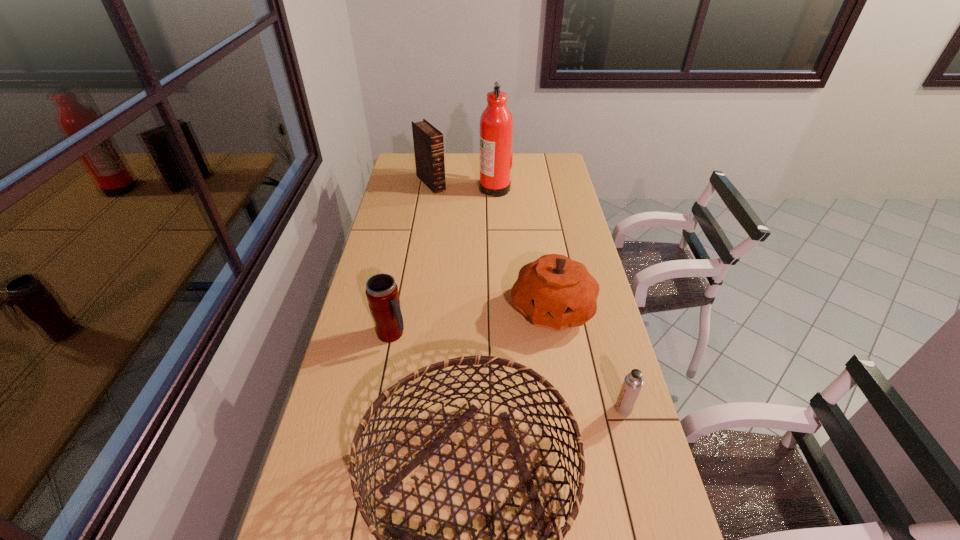
Identify the location of vacant space at the far edge of the desktop. The image size is (960, 540). 476,164.

Where is `blank space at the left edge`? This screenshot has height=540, width=960. blank space at the left edge is located at coordinates (364, 375).

The height and width of the screenshot is (540, 960). In the image, there is a desktop. Find the location of `free space at the right edge`. free space at the right edge is located at coordinates (561, 248).

At what (x,y) coordinates should I click in order to perform the action: click on free space at the far left corner of the desktop. Please return your answer as a coordinate pair (x, y). Looking at the image, I should click on (414, 172).

Find the location of a particular element. Image resolution: width=960 pixels, height=540 pixels. free space between the pumpkin and the shorter thermos bottle is located at coordinates (588, 359).

Find the location of a particular element. vacant area that lies between the pumpkin and the left thermos bottle is located at coordinates (472, 321).

Find the location of a particular element. This screenshot has height=540, width=960. empty location between the fire extinguisher and the pumpkin is located at coordinates (523, 248).

Locate an element on the screen. This screenshot has width=960, height=540. object that is the fourth closest one to the Bible is located at coordinates (407, 538).

Find the location of a particular element. This screenshot has height=540, width=960. object that is the second closest one to the tallest object is located at coordinates (555, 292).

This screenshot has height=540, width=960. What are the coordinates of `free space in the image that satisfies the following two spatial constraints: 1. on the front-facing side of the pumpkin; 2. on the right side of the nearer thermos bottle` in the screenshot? It's located at (569, 409).